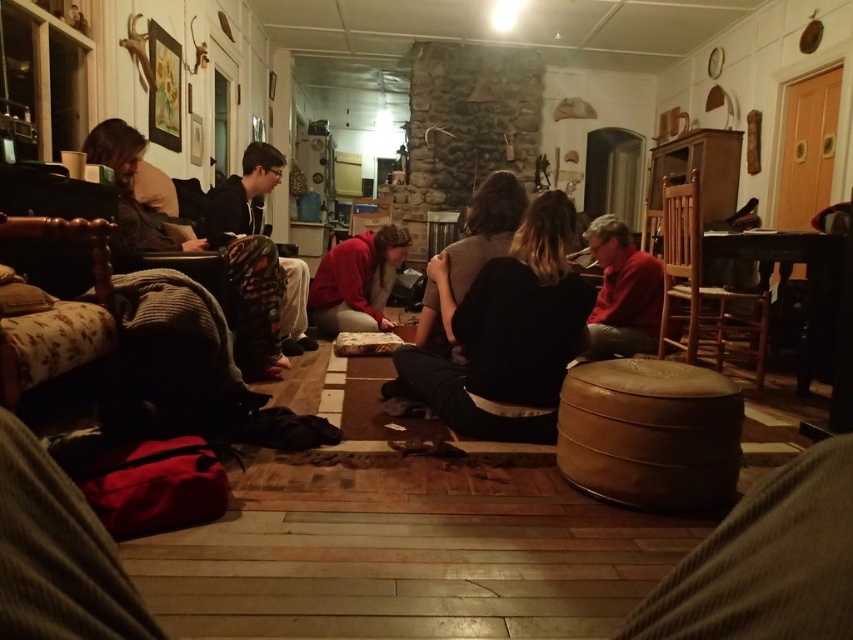
You are standing in the living room and want to place a 6 feet long ladder in the room. The ladder needs to be placed at point (695,436). Can you fit the ladder there?

The point (695,436) is 5.74 feet away from you. Since the ladder is 6 feet long, it may not fit as the distance from you to the point is shorter than the ladder length. Check other areas for space.

You are a guest at this gathering and want to sit closer to the fireplace. You are currently standing near the red matte sweater at right. Which direction should you move to reach the leather ottoman at center?

The leather ottoman at center is in front of the red matte sweater at right, so you should move forward towards the fireplace to reach it.

You are sitting in the floral fabric armchair at left and want to pass a book to someone wearing the red matte sweater at right. Can you reach them without getting up?

The floral fabric armchair at left is closer to the viewer than the red matte sweater at right, so you would need to stretch or get up to reach them.